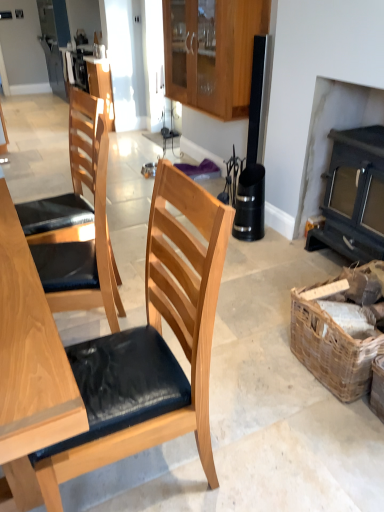
Where is `dark gray wood fireplace at right`? This screenshot has width=384, height=512. dark gray wood fireplace at right is located at coordinates (354, 196).

Measure the distance between point (165, 54) and camera.

They are 13.38 feet apart.

Measure the distance between point (101, 62) and camera.

They are 20.88 feet apart.

Describe the element at coordinates (101, 86) in the screenshot. The height and width of the screenshot is (512, 384). I see `matte wood cabinet at upper center, which is the second cabinetry in right-to-left order` at that location.

Measure the distance between point (44, 250) and camera.

A distance of 2.00 meters exists between point (44, 250) and camera.

Describe the element at coordinates (160, 334) in the screenshot. Image resolution: width=384 pixels, height=512 pixels. I see `wooden chair with cushion at center, which is the 1th chair from bottom to top` at that location.

What is the approximate height of woven brown picnic basket at lower right?

It is 15.20 inches.

Locate an element on the screen. Image resolution: width=384 pixels, height=512 pixels. dark gray wood fireplace at right is located at coordinates (354, 196).

Is matte wood cabinet at upper center, which is the second cabinetry in right-to-left order, oriented away from wooden chair with cushion at center, which is the 1th chair from bottom to top?

No, matte wood cabinet at upper center, which is the second cabinetry in right-to-left order, is not facing away from wooden chair with cushion at center, which is the 1th chair from bottom to top.

Image resolution: width=384 pixels, height=512 pixels. Find the location of `the 1st chair directly above the matte wood cabinet at upper center, which is the second cabinetry in right-to-left order (from a real-world perspective)`. the 1st chair directly above the matte wood cabinet at upper center, which is the second cabinetry in right-to-left order (from a real-world perspective) is located at coordinates (160, 334).

How different are the orientations of matte wood cabinet at upper center, which is the second cabinetry in right-to-left order, and wooden chair with cushion at center, the 2th chair viewed from the top, in degrees?

They differ by 1.42 degrees in their facing directions.

Which is more to the right, matte wood cabinet at upper center, the first cabinetry in the back-to-front sequence, or wooden chair with cushion at center, the 2th chair viewed from the top?

wooden chair with cushion at center, the 2th chair viewed from the top.

Is woven brown picnic basket at lower right behind matte wood cabinet at upper center, which ranks as the 2th cabinetry in front-to-back order?

No, woven brown picnic basket at lower right is closer to the camera.

In the scene shown: Considering the positions of objects woven brown picnic basket at lower right and matte wood cabinet at upper center, arranged as the first cabinetry when viewed from the left, in the image provided, who is more to the left, woven brown picnic basket at lower right or matte wood cabinet at upper center, arranged as the first cabinetry when viewed from the left,?

From the viewer's perspective, matte wood cabinet at upper center, arranged as the first cabinetry when viewed from the left, appears more on the left side.

Is woven brown picnic basket at lower right touching matte wood cabinet at upper center, arranged as the first cabinetry when viewed from the left?

No.

Which object is wider, woven brown picnic basket at lower right or matte wood cabinet at upper center, arranged as the first cabinetry when viewed from the left?

woven brown picnic basket at lower right.

Who is smaller, matte wood cabinet at upper center, the first cabinetry in the back-to-front sequence, or light brown wood chair at left, marked as the 1th chair in a top-to-bottom arrangement?

matte wood cabinet at upper center, the first cabinetry in the back-to-front sequence.

From the image's perspective, which object appears higher, matte wood cabinet at upper center, which is the second cabinetry in right-to-left order, or light brown wood chair at left, which appears as the 2th chair when ordered from the bottom?

matte wood cabinet at upper center, which is the second cabinetry in right-to-left order, from the image's perspective.

Between matte wood cabinet at upper center, the first cabinetry in the back-to-front sequence, and light brown wood chair at left, which appears as the 2th chair when ordered from the bottom, which one appears on the left side from the viewer's perspective?

From the viewer's perspective, matte wood cabinet at upper center, the first cabinetry in the back-to-front sequence, appears more on the left side.

Is matte wood cabinet at upper center, arranged as the first cabinetry when viewed from the left, oriented away from light brown wood chair at left, which appears as the 2th chair when ordered from the bottom?

No, light brown wood chair at left, which appears as the 2th chair when ordered from the bottom, is not at the back of matte wood cabinet at upper center, arranged as the first cabinetry when viewed from the left.

Between point (359, 129) and point (104, 148), which one is positioned in front?

The point (104, 148) is in front.

Is dark gray wood fireplace at right positioned beyond the bounds of light brown wood chair at left, marked as the 1th chair in a top-to-bottom arrangement?

dark gray wood fireplace at right lies outside light brown wood chair at left, marked as the 1th chair in a top-to-bottom arrangement,'s area.

From the image's perspective, which one is positioned lower, dark gray wood fireplace at right or light brown wood chair at left, marked as the 1th chair in a top-to-bottom arrangement?

light brown wood chair at left, marked as the 1th chair in a top-to-bottom arrangement, is shown below in the image.

Looking at this image, are wooden cabinet at upper center, placed as the first cabinetry when sorted from front to back, and light brown wood chair at left, which appears as the 2th chair when ordered from the bottom, beside each other?

No, wooden cabinet at upper center, placed as the first cabinetry when sorted from front to back, is not next to light brown wood chair at left, which appears as the 2th chair when ordered from the bottom.

From the image's perspective, is wooden cabinet at upper center, which is the first cabinetry from right to left, located above or below light brown wood chair at left, which appears as the 2th chair when ordered from the bottom?

Based on their image positions, wooden cabinet at upper center, which is the first cabinetry from right to left, is located above light brown wood chair at left, which appears as the 2th chair when ordered from the bottom.

Is wooden cabinet at upper center, which is the first cabinetry from right to left, further to the viewer compared to light brown wood chair at left, which appears as the 2th chair when ordered from the bottom?

Yes, the depth of wooden cabinet at upper center, which is the first cabinetry from right to left, is greater than that of light brown wood chair at left, which appears as the 2th chair when ordered from the bottom.

Is point (190, 60) positioned in front of point (92, 156)?

No.

Is woven brown picnic basket at lower right inside matte wood cabinet at upper center, which ranks as the 2th cabinetry in front-to-back order?

No, woven brown picnic basket at lower right is not inside matte wood cabinet at upper center, which ranks as the 2th cabinetry in front-to-back order.

Considering the sizes of objects matte wood cabinet at upper center, the first cabinetry in the back-to-front sequence, and woven brown picnic basket at lower right in the image provided, who is thinner, matte wood cabinet at upper center, the first cabinetry in the back-to-front sequence, or woven brown picnic basket at lower right?

matte wood cabinet at upper center, the first cabinetry in the back-to-front sequence, is thinner.

From the image's perspective, is matte wood cabinet at upper center, the first cabinetry in the back-to-front sequence, above or below woven brown picnic basket at lower right?

Clearly, from the image's perspective, matte wood cabinet at upper center, the first cabinetry in the back-to-front sequence, is above woven brown picnic basket at lower right.

Could you measure the distance between matte wood cabinet at upper center, which is the second cabinetry in right-to-left order, and woven brown picnic basket at lower right?

They are 4.79 feet apart.

You are a GUI agent. You are given a task and a screenshot of the screen. Output one action in this format:
    pyautogui.click(x=<x>, y=<y>)
    Task: Click on the picnic basket in front of the wooden cabinet at upper center, which is the 2th cabinetry in left-to-right order
    
    Given the screenshot: What is the action you would take?
    pyautogui.click(x=341, y=331)

What's the angular difference between woven brown picnic basket at lower right and wooden cabinet at upper center, which is the 2th cabinetry in left-to-right order,'s facing directions?

They differ by 0.121 degrees in their facing directions.

Is woven brown picnic basket at lower right facing towards wooden cabinet at upper center, placed as the first cabinetry when sorted from front to back?

No, woven brown picnic basket at lower right is not facing towards wooden cabinet at upper center, placed as the first cabinetry when sorted from front to back.

Is woven brown picnic basket at lower right positioned far away from wooden cabinet at upper center, which is counted as the 2th cabinetry, starting from the back?

woven brown picnic basket at lower right is far away from wooden cabinet at upper center, which is counted as the 2th cabinetry, starting from the back.

From a real-world perspective, starting from the matte wood cabinet at upper center, which ranks as the 2th cabinetry in front-to-back order, which chair is the 1st one vertically above it? Please provide its 2D coordinates.

[(160, 334)]

Where is `picnic basket beneath the matte wood cabinet at upper center, which ranks as the 2th cabinetry in front-to-back order (from a real-world perspective)`? The image size is (384, 512). picnic basket beneath the matte wood cabinet at upper center, which ranks as the 2th cabinetry in front-to-back order (from a real-world perspective) is located at coordinates (341, 331).

Estimate the real-world distances between objects in this image. Which object is closer to dark gray wood fireplace at right, woven brown picnic basket at lower right or matte wood cabinet at upper center, the first cabinetry in the back-to-front sequence?

Among the two, woven brown picnic basket at lower right is located nearer to dark gray wood fireplace at right.

Looking at the image, which one is located further to woven brown picnic basket at lower right, light brown wood chair at left, marked as the 1th chair in a top-to-bottom arrangement, or wooden chair with cushion at center, which is the 1th chair from bottom to top?

light brown wood chair at left, marked as the 1th chair in a top-to-bottom arrangement, is further to woven brown picnic basket at lower right.

From the image, which object appears to be farther from light brown wood chair at left, marked as the 1th chair in a top-to-bottom arrangement, wooden cabinet at upper center, which is the first cabinetry from right to left, or dark gray wood fireplace at right?

wooden cabinet at upper center, which is the first cabinetry from right to left, is positioned further to the anchor light brown wood chair at left, marked as the 1th chair in a top-to-bottom arrangement.

When comparing their distances from matte wood cabinet at upper center, arranged as the first cabinetry when viewed from the left, does dark gray wood fireplace at right or wooden cabinet at upper center, placed as the first cabinetry when sorted from front to back, seem further?

Among the two, wooden cabinet at upper center, placed as the first cabinetry when sorted from front to back, is located further to matte wood cabinet at upper center, arranged as the first cabinetry when viewed from the left.

Consider the image. Estimate the real-world distances between objects in this image. Which object is further from wooden cabinet at upper center, which is counted as the 2th cabinetry, starting from the back, light brown wood chair at left, which appears as the 2th chair when ordered from the bottom, or woven brown picnic basket at lower right?

woven brown picnic basket at lower right lies further to wooden cabinet at upper center, which is counted as the 2th cabinetry, starting from the back, than the other object.

Estimate the real-world distances between objects in this image. Which object is closer to wooden cabinet at upper center, which is the first cabinetry from right to left, matte wood cabinet at upper center, which is the second cabinetry in right-to-left order, or woven brown picnic basket at lower right?

matte wood cabinet at upper center, which is the second cabinetry in right-to-left order, is positioned closer to the anchor wooden cabinet at upper center, which is the first cabinetry from right to left.

From the image, which object appears to be nearer to wooden chair with cushion at center, the 2th chair viewed from the top, light brown wood chair at left, marked as the 1th chair in a top-to-bottom arrangement, or dark gray wood fireplace at right?

light brown wood chair at left, marked as the 1th chair in a top-to-bottom arrangement, is positioned closer to the anchor wooden chair with cushion at center, the 2th chair viewed from the top.

Based on their spatial positions, is dark gray wood fireplace at right or wooden chair with cushion at center, which is the 1th chair from bottom to top, closer to wooden cabinet at upper center, placed as the first cabinetry when sorted from front to back?

Based on the image, dark gray wood fireplace at right appears to be nearer to wooden cabinet at upper center, placed as the first cabinetry when sorted from front to back.

What are the coordinates of `cabinetry positioned between wooden chair with cushion at center, the 2th chair viewed from the top, and matte wood cabinet at upper center, which ranks as the 2th cabinetry in front-to-back order, from near to far` in the screenshot? It's located at (212, 53).

Image resolution: width=384 pixels, height=512 pixels. What are the coordinates of `cabinetry between light brown wood chair at left, marked as the 1th chair in a top-to-bottom arrangement, and matte wood cabinet at upper center, the first cabinetry in the back-to-front sequence, along the z-axis` in the screenshot? It's located at (212, 53).

Find the location of a particular element. chair situated between light brown wood chair at left, which appears as the 2th chair when ordered from the bottom, and woven brown picnic basket at lower right from left to right is located at coordinates (160, 334).

Find the location of a particular element. cabinetry located between woven brown picnic basket at lower right and matte wood cabinet at upper center, arranged as the first cabinetry when viewed from the left, in the depth direction is located at coordinates (212, 53).